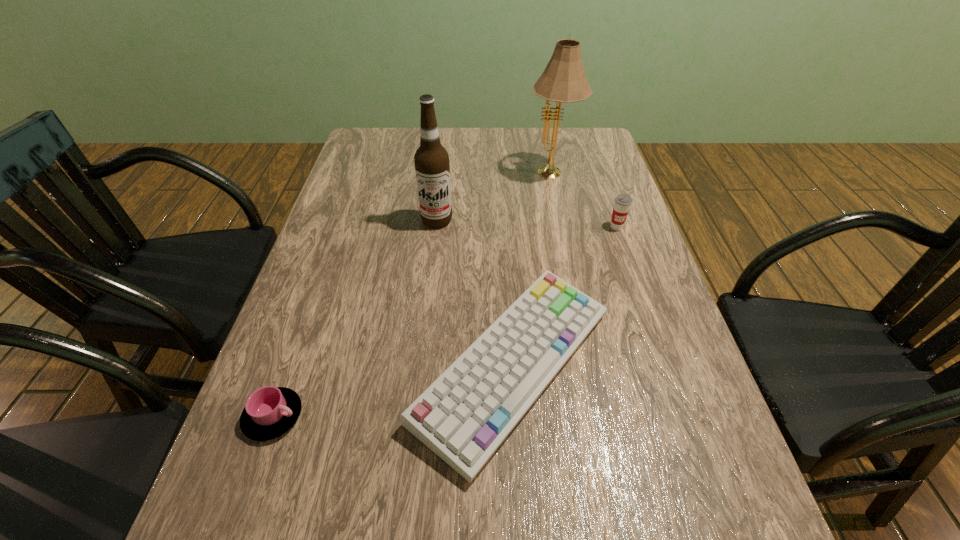
At what (x,y) coordinates should I click in order to perform the action: click on empty space between the third tallest object and the alcohol. Please return your answer as a coordinate pair (x, y). Looking at the image, I should click on (527, 224).

Locate an element on the screen. The image size is (960, 540). free area in between the fourth shortest object and the third tallest object is located at coordinates (527, 224).

At what (x,y) coordinates should I click in order to perform the action: click on free space between the computer keyboard and the fourth shortest object. Please return your answer as a coordinate pair (x, y). The image size is (960, 540). Looking at the image, I should click on (475, 293).

Locate an element on the screen. Image resolution: width=960 pixels, height=540 pixels. object that stands as the third closest to the lampshade is located at coordinates (464, 416).

Where is `the third closest object to the alcohol`? The width and height of the screenshot is (960, 540). the third closest object to the alcohol is located at coordinates (622, 202).

Find the location of a particular element. vacant space that satisfies the following two spatial constraints: 1. on the label of the computer keyboard; 2. on the right side of the alcohol is located at coordinates (420, 366).

Identify the location of blank space that satisfies the following two spatial constraints: 1. on the back side of the farthest object; 2. on the right side of the computer keyboard. The width and height of the screenshot is (960, 540). (501, 175).

Where is `vacant point that satisfies the following two spatial constraints: 1. on the label of the alcohol; 2. on the right side of the computer keyboard`? The image size is (960, 540). vacant point that satisfies the following two spatial constraints: 1. on the label of the alcohol; 2. on the right side of the computer keyboard is located at coordinates (420, 366).